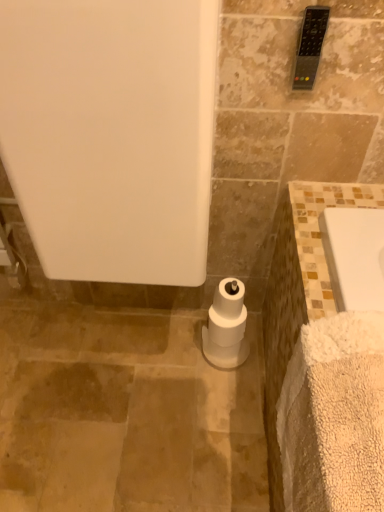
Measure the distance between point (x=231, y=281) and camera.

Point (x=231, y=281) is 1.24 meters away from camera.

I want to click on white matte toilet paper at center, so click(x=226, y=326).

You are a GUI agent. You are given a task and a screenshot of the screen. Output one action in this format:
    pyautogui.click(x=<x>, y=<y>)
    Task: Click on the black plastic remote control at upper right
    This screenshot has width=384, height=512.
    Given the screenshot: What is the action you would take?
    pyautogui.click(x=310, y=46)

Describe the element at coordinates (111, 134) in the screenshot. The height and width of the screenshot is (512, 384). I see `white matte bathtub at center` at that location.

You are a GUI agent. You are given a task and a screenshot of the screen. Output one action in this format:
    pyautogui.click(x=<x>, y=<y>)
    Task: Click on the white fluffy bath towel at lower right
    The height and width of the screenshot is (512, 384).
    Given the screenshot: What is the action you would take?
    pyautogui.click(x=334, y=416)

Does white fluffy bath towel at lower right appear on the right side of white matte bathtub at center?

Correct, you'll find white fluffy bath towel at lower right to the right of white matte bathtub at center.

Consider the image. Considering the relative sizes of white fluffy bath towel at lower right and white matte bathtub at center in the image provided, is white fluffy bath towel at lower right bigger than white matte bathtub at center?

No.

Looking at this image, does white fluffy bath towel at lower right have a greater height compared to white matte bathtub at center?

Incorrect, the height of white fluffy bath towel at lower right is not larger of that of white matte bathtub at center.

Could you tell me if black plastic remote control at upper right is turned towards white fluffy bath towel at lower right?

Answer: No, black plastic remote control at upper right does not turn towards white fluffy bath towel at lower right.

From the image's perspective, which is above, black plastic remote control at upper right or white fluffy bath towel at lower right?

From the image's view, black plastic remote control at upper right is above.

Looking at their sizes, would you say black plastic remote control at upper right is wider or thinner than white fluffy bath towel at lower right?

black plastic remote control at upper right is thinner than white fluffy bath towel at lower right.

Which of these two, black plastic remote control at upper right or white fluffy bath towel at lower right, stands taller?

Standing taller between the two is white fluffy bath towel at lower right.

Does black plastic remote control at upper right have a larger size compared to white matte bathtub at center?

No, black plastic remote control at upper right is not bigger than white matte bathtub at center.

From a real-world perspective, is black plastic remote control at upper right positioned over white matte bathtub at center based on gravity?

Yes, from a real-world perspective, black plastic remote control at upper right is over white matte bathtub at center

This screenshot has height=512, width=384. In order to click on towel bar behind the white matte bathtub at center in this screenshot , I will do `click(310, 46)`.

From the image's perspective, is black plastic remote control at upper right over white matte bathtub at center?

Correct, black plastic remote control at upper right appears higher than white matte bathtub at center in the image.

Could you tell me if white matte toilet paper at center is facing white matte bathtub at center?

No.

Locate an element on the screen. The image size is (384, 512). toilet paper lying on the right of white matte bathtub at center is located at coordinates (226, 326).

How many degrees apart are the facing directions of white matte toilet paper at center and white matte bathtub at center?

They differ by 1.43 degrees in their facing directions.

Consider the image. Does white matte toilet paper at center have a greater width compared to white matte bathtub at center?

No, white matte toilet paper at center is not wider than white matte bathtub at center.

Considering the relative positions of white matte toilet paper at center and black plastic remote control at upper right in the image provided, is white matte toilet paper at center to the left of black plastic remote control at upper right from the viewer's perspective?

Yes.

Looking at this image, what's the angular difference between white matte toilet paper at center and black plastic remote control at upper right's facing directions?

The facing directions of white matte toilet paper at center and black plastic remote control at upper right are 1.43 degrees apart.

Is white matte toilet paper at center positioned far away from black plastic remote control at upper right?

No, white matte toilet paper at center is not far away from black plastic remote control at upper right.

Considering the sizes of black plastic remote control at upper right and white matte toilet paper at center in the image, is black plastic remote control at upper right wider or thinner than white matte toilet paper at center?

In the image, black plastic remote control at upper right appears to be more narrow than white matte toilet paper at center.

Would you say white matte toilet paper at center is part of black plastic remote control at upper right's contents?

No, white matte toilet paper at center is located outside of black plastic remote control at upper right.

From the image's perspective, relative to white matte toilet paper at center, is black plastic remote control at upper right above or below?

black plastic remote control at upper right is above white matte toilet paper at center.

Can you confirm if black plastic remote control at upper right is taller than white matte toilet paper at center?

In fact, black plastic remote control at upper right may be shorter than white matte toilet paper at center.

What's the angular difference between white fluffy bath towel at lower right and white matte toilet paper at center's facing directions?

There is a 92.1-degree angle between the facing directions of white fluffy bath towel at lower right and white matte toilet paper at center.

Between white fluffy bath towel at lower right and white matte toilet paper at center, which one has more height?

white fluffy bath towel at lower right is taller.

Consider the image. Which object is positioned more to the left, white fluffy bath towel at lower right or white matte toilet paper at center?

Positioned to the left is white matte toilet paper at center.

Is white fluffy bath towel at lower right aimed at white matte toilet paper at center?

No.

Find the location of a particular element. The height and width of the screenshot is (512, 384). bath behind the white fluffy bath towel at lower right is located at coordinates (111, 134).

The width and height of the screenshot is (384, 512). Find the location of `bath towel directly beneath the black plastic remote control at upper right (from a real-world perspective)`. bath towel directly beneath the black plastic remote control at upper right (from a real-world perspective) is located at coordinates (334, 416).

From the image, which object appears to be farther from white matte toilet paper at center, white matte bathtub at center or black plastic remote control at upper right?

Based on the image, black plastic remote control at upper right appears to be further to white matte toilet paper at center.

In the scene shown: Looking at the image, which one is located further to black plastic remote control at upper right, white fluffy bath towel at lower right or white matte toilet paper at center?

white matte toilet paper at center.

Based on their spatial positions, is white matte toilet paper at center or white fluffy bath towel at lower right closer to white matte bathtub at center?

white fluffy bath towel at lower right is positioned closer to the anchor white matte bathtub at center.

When comparing their distances from white fluffy bath towel at lower right, does black plastic remote control at upper right or white matte toilet paper at center seem further?

black plastic remote control at upper right lies further to white fluffy bath towel at lower right than the other object.

Considering their positions, is white matte bathtub at center positioned further to white fluffy bath towel at lower right than white matte toilet paper at center?

white matte toilet paper at center is positioned further to the anchor white fluffy bath towel at lower right.

Which object lies further to the anchor point black plastic remote control at upper right, white matte toilet paper at center or white fluffy bath towel at lower right?

white matte toilet paper at center is positioned further to the anchor black plastic remote control at upper right.

Considering their positions, is white matte toilet paper at center positioned closer to white fluffy bath towel at lower right than black plastic remote control at upper right?

The object closer to white fluffy bath towel at lower right is white matte toilet paper at center.

Based on their spatial positions, is black plastic remote control at upper right or white matte bathtub at center further from white fluffy bath towel at lower right?

black plastic remote control at upper right.

The width and height of the screenshot is (384, 512). Find the location of `bath between black plastic remote control at upper right and white matte toilet paper at center in the vertical direction`. bath between black plastic remote control at upper right and white matte toilet paper at center in the vertical direction is located at coordinates (111, 134).

This screenshot has height=512, width=384. I want to click on bath between white fluffy bath towel at lower right and white matte toilet paper at center in the front-back direction, so click(111, 134).

Where is `toilet paper between black plastic remote control at upper right and white fluffy bath towel at lower right in the up-down direction`? The height and width of the screenshot is (512, 384). toilet paper between black plastic remote control at upper right and white fluffy bath towel at lower right in the up-down direction is located at coordinates (226, 326).

Where is `bath that lies between black plastic remote control at upper right and white fluffy bath towel at lower right from top to bottom`? The image size is (384, 512). bath that lies between black plastic remote control at upper right and white fluffy bath towel at lower right from top to bottom is located at coordinates [111, 134].